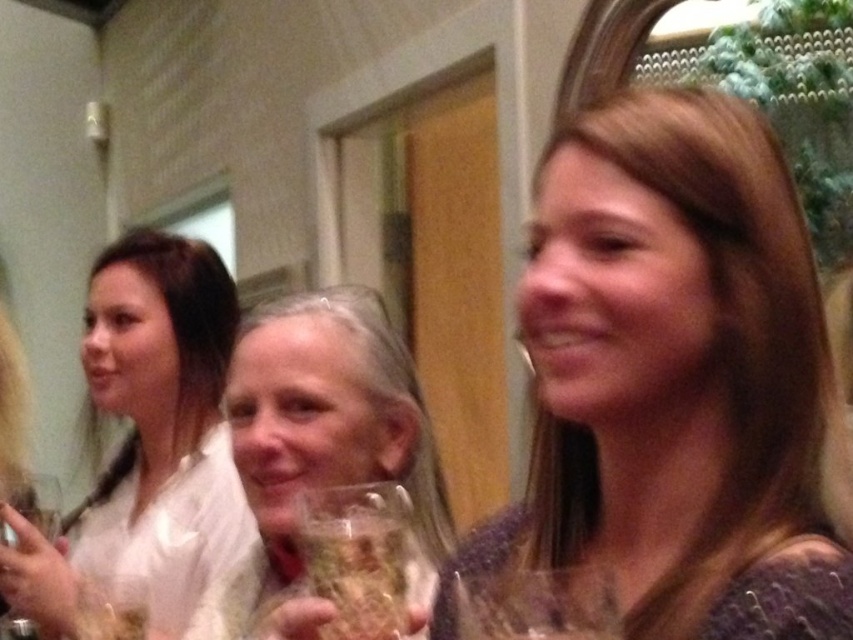
Question: Where is matte purple dress at center located in relation to translucent glass wine glass at center in the image?

Choices:
 (A) left
 (B) right

Answer: (B)

Question: Does matte white blouse at left lie in front of translucent glass wine glass at center?

Choices:
 (A) no
 (B) yes

Answer: (A)

Question: Estimate the real-world distances between objects in this image. Which object is farther from the matte purple dress at center?

Choices:
 (A) translucent glass at center
 (B) matte white blouse at left
 (C) clear glass wine glass at center

Answer: (B)

Question: Is the position of matte purple dress at center more distant than that of clear glass wine glass at lower left?

Choices:
 (A) yes
 (B) no

Answer: (B)

Question: Which point is closer to the camera?

Choices:
 (A) clear glass wine glass at lower left
 (B) translucent glass wine glass at center
 (C) matte purple dress at center
 (D) matte white blouse at left

Answer: (B)

Question: Which object is the closest to the matte purple dress at center?

Choices:
 (A) translucent glass at center
 (B) translucent glass wine glass at center
 (C) clear glass wine glass at center

Answer: (B)